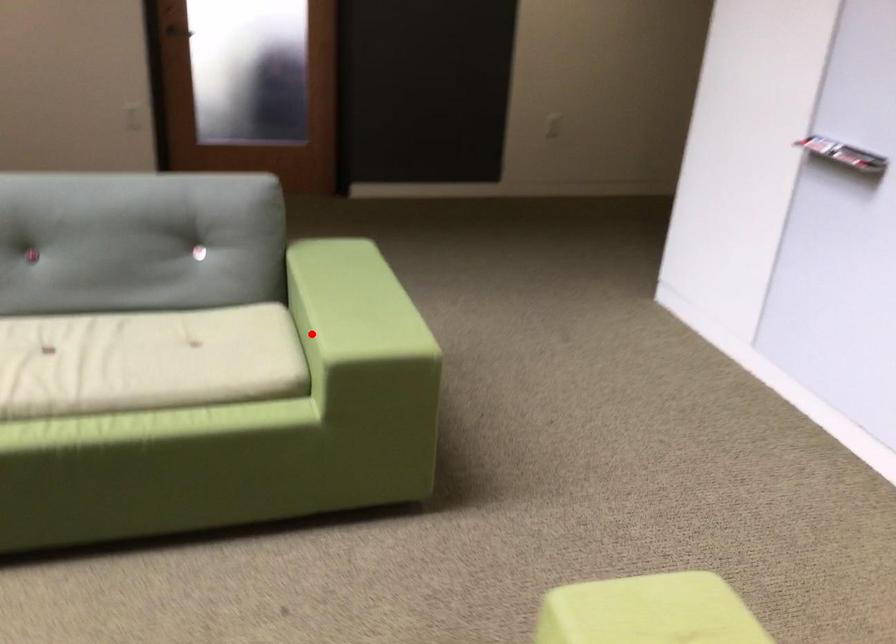
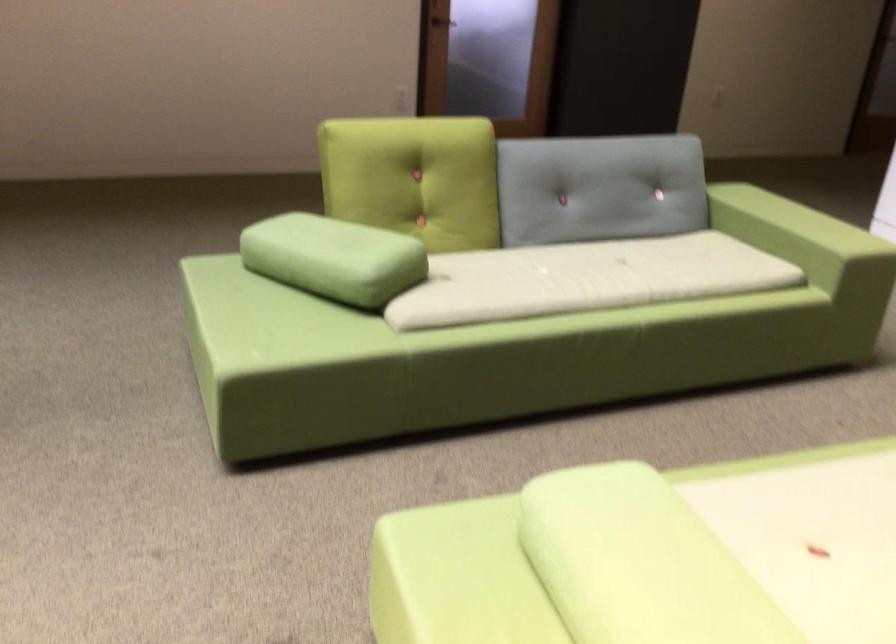
The point at the highlighted location is marked in the first image. Where is the corresponding point in the second image?

(794, 241)